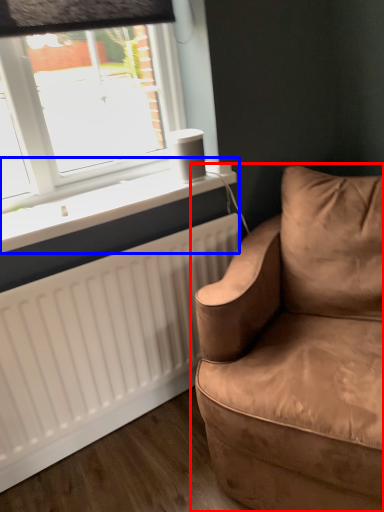
Question: Which object appears farthest to the camera in this image, studio couch (highlighted by a red box) or window sill (highlighted by a blue box)?

Choices:
 (A) studio couch
 (B) window sill

Answer: (B)